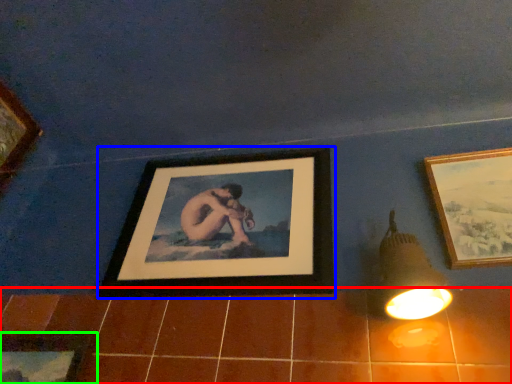
Question: Which object is positioned closest to ceramic tile (highlighted by a red box)? Select from picture frame (highlighted by a blue box) and picture frame (highlighted by a green box).

Choices:
 (A) picture frame
 (B) picture frame

Answer: (A)